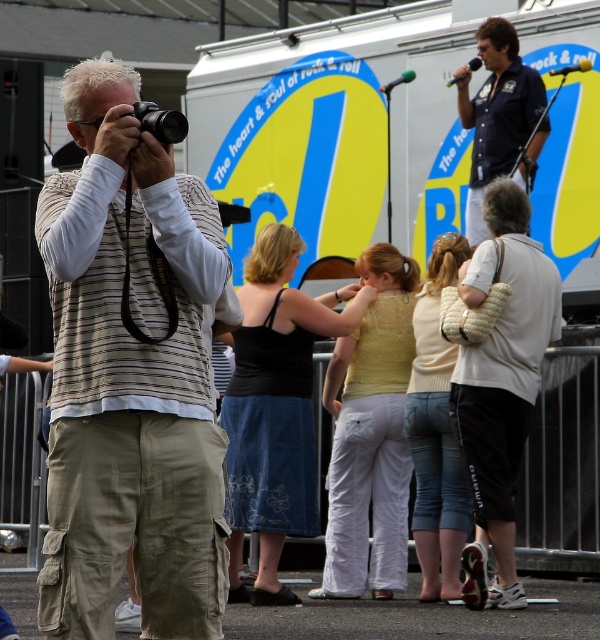
The width and height of the screenshot is (600, 640). Describe the element at coordinates (130, 378) in the screenshot. I see `striped fabric camera at left` at that location.

Is striped fabric camera at left smaller than white textured shirt at center?

No.

Where is `striped fabric camera at left`? striped fabric camera at left is located at coordinates (130, 378).

Identify the location of striped fabric camera at left. (130, 378).

Between striped fabric camera at left and dark blue shirt at upper right, which one is positioned lower?

striped fabric camera at left is lower down.

Is striped fabric camera at left wider than dark blue shirt at upper right?

Yes.

Where is `striped fabric camera at left`? Image resolution: width=600 pixels, height=640 pixels. striped fabric camera at left is located at coordinates (130, 378).

I want to click on striped fabric camera at left, so click(x=130, y=378).

Does white textured shirt at center have a lesser width compared to dark blue shirt at upper right?

In fact, white textured shirt at center might be wider than dark blue shirt at upper right.

Is white textured shirt at center bigger than dark blue shirt at upper right?

Yes, white textured shirt at center is bigger than dark blue shirt at upper right.

Where is `white textured shirt at center`? white textured shirt at center is located at coordinates (502, 384).

The width and height of the screenshot is (600, 640). Find the location of `white textured shirt at center`. white textured shirt at center is located at coordinates (502, 384).